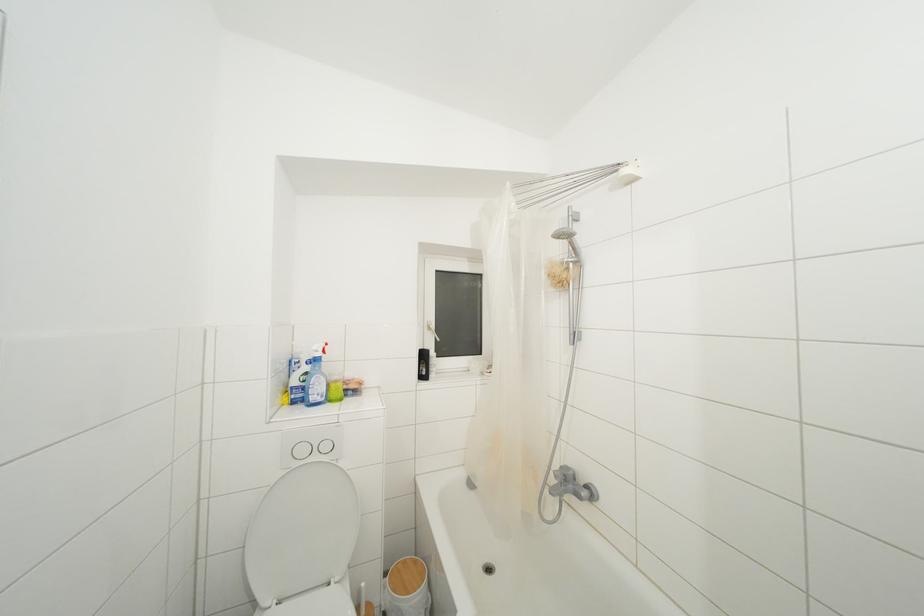
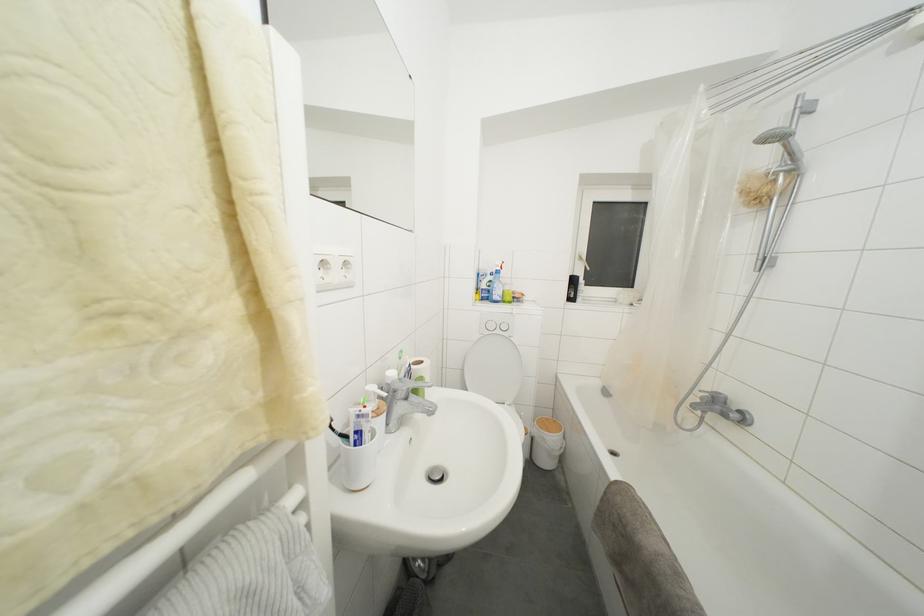
The point at (578, 254) is marked in the first image. Where is the corresponding point in the second image?

(796, 159)